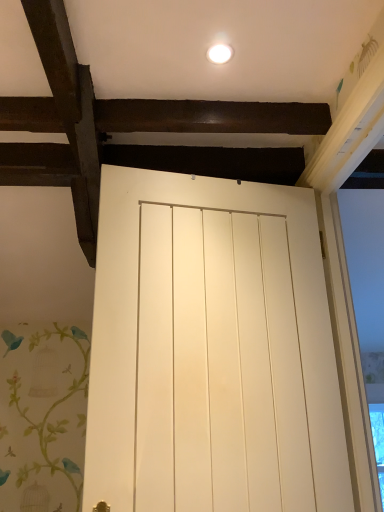
Question: Relative to white glossy light fixture at upper center, is white matte door at center in front or behind?

Choices:
 (A) behind
 (B) front

Answer: (B)

Question: From a real-world perspective, relative to white glossy light fixture at upper center, is white matte door at center vertically above or below?

Choices:
 (A) below
 (B) above

Answer: (A)

Question: In the image, is white matte door at center on the left side or the right side of white glossy light fixture at upper center?

Choices:
 (A) left
 (B) right

Answer: (B)

Question: Does point (231, 53) appear closer or farther from the camera than point (162, 262)?

Choices:
 (A) closer
 (B) farther

Answer: (A)

Question: Considering the relative positions of white glossy light fixture at upper center and white matte door at center in the image provided, is white glossy light fixture at upper center to the left or to the right of white matte door at center?

Choices:
 (A) right
 (B) left

Answer: (B)

Question: Considering their positions, is white glossy light fixture at upper center located in front of or behind white matte door at center?

Choices:
 (A) behind
 (B) front

Answer: (A)

Question: Based on their sizes in the image, would you say white glossy light fixture at upper center is bigger or smaller than white matte door at center?

Choices:
 (A) small
 (B) big

Answer: (A)